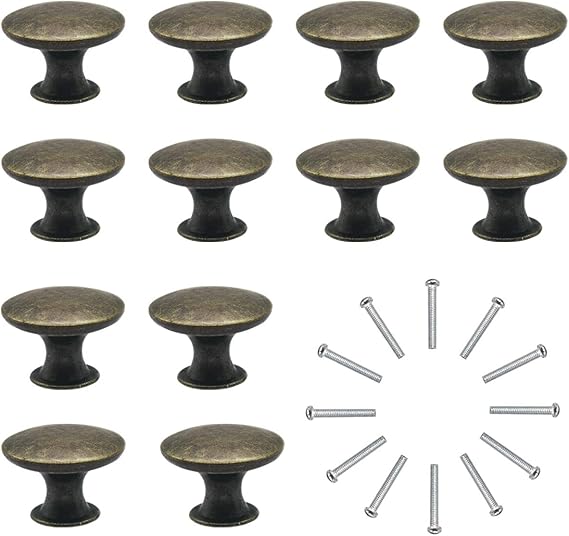
Where is `base of knob`? base of knob is located at coordinates (537, 232).